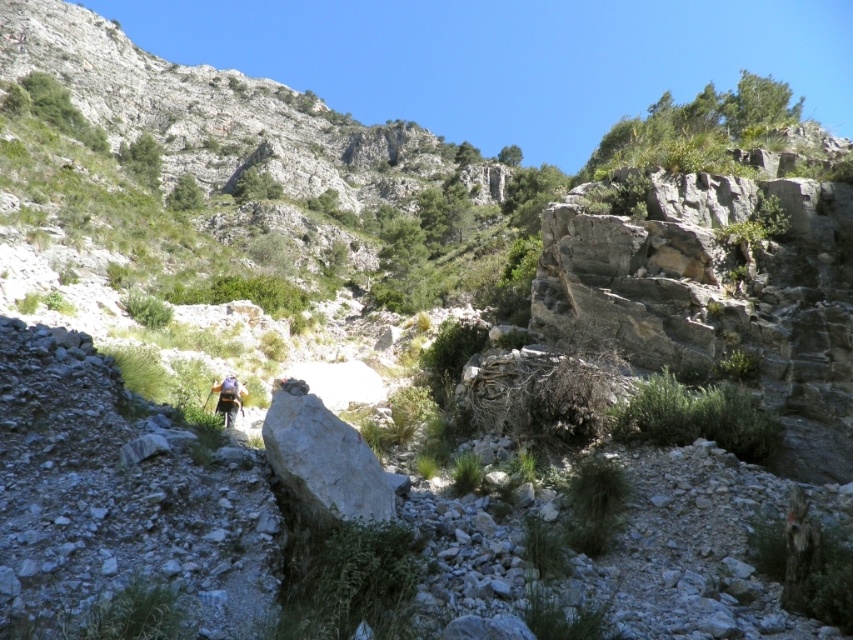
Question: In this image, where is white smooth rock at center located relative to light blue fabric backpack at center?

Choices:
 (A) left
 (B) right

Answer: (B)

Question: Is white smooth rock at center positioned at the back of light blue fabric backpack at center?

Choices:
 (A) no
 (B) yes

Answer: (A)

Question: Does white smooth rock at center appear on the left side of light blue fabric backpack at center?

Choices:
 (A) no
 (B) yes

Answer: (A)